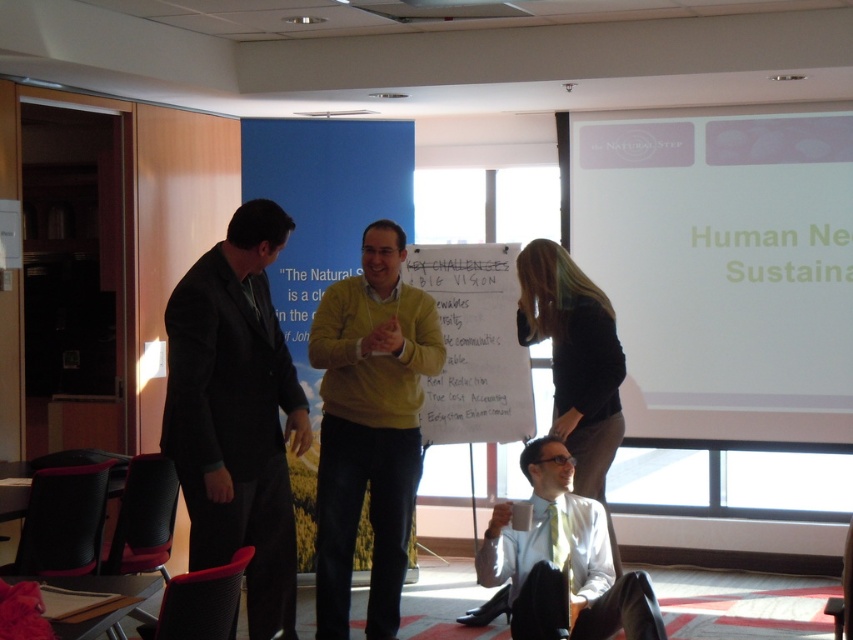
You are setting up a presentation and need to decide where to place your projector. The projector can only project onto surfaces larger than the matte yellow sweater at center. Based on the scene, is the white matte projection screen at upper right a suitable surface for the projector?

The white matte projection screen at upper right is bigger than the matte yellow sweater at center, so yes, the white matte projection screen at upper right is a suitable surface for the projector since it is larger than the required size.

In the scene shown: In the conference room scene, there is a white matte projection screen at upper right and a matte yellow sweater at center. From the perspective of someone standing at the entrance facing the room, which object is positioned to the left?

The matte yellow sweater at center is to the left of the white matte projection screen at upper right from the entrance perspective.

You are a photographer in this scene and want to take a photo of the black suit at left and the light brown leather jacket at lower center. Which one will appear larger in the photo?

The black suit at left is in front of the light brown leather jacket at lower center, so it will appear larger in the photo because objects closer to the camera appear bigger.